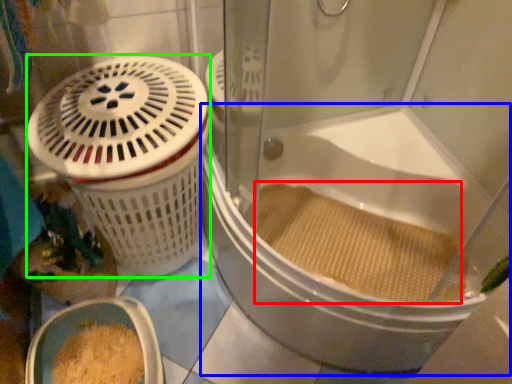
Question: Which object is the farthest from debris (highlighted by a red box)? Choose among these: bathtub (highlighted by a blue box) or basket container (highlighted by a green box).

Choices:
 (A) bathtub
 (B) basket container

Answer: (B)